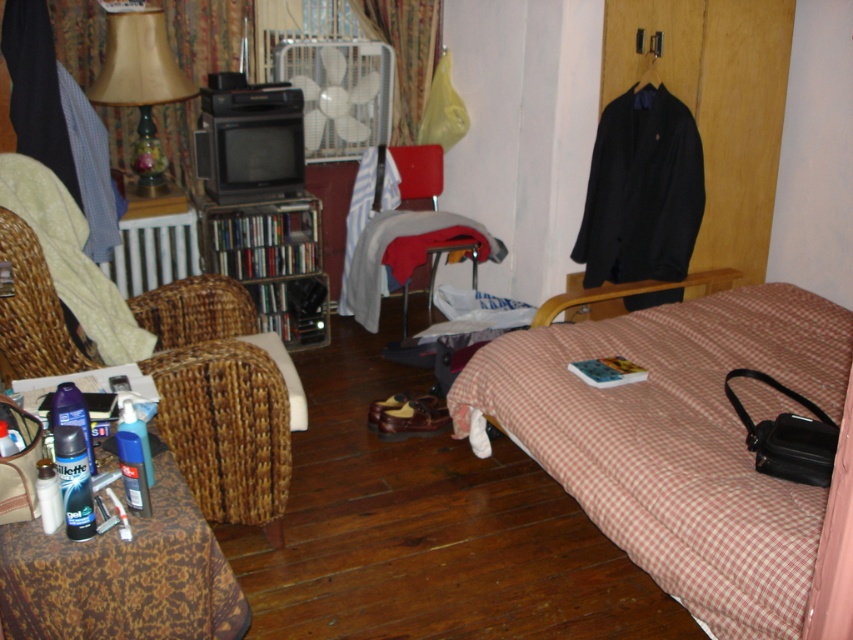
Question: Which is nearer to the white metal radiator at left?

Choices:
 (A) checkered fabric bed at lower right
 (B) woven wicker armchair at left

Answer: (B)

Question: Among these points, which one is nearest to the camera?

Choices:
 (A) (639, 541)
 (B) (16, 312)
 (C) (155, 260)
 (D) (403, 141)

Answer: (A)

Question: Does metallic silver bookshelf at center appear on the right side of matte fabric lamp at upper left?

Choices:
 (A) no
 (B) yes

Answer: (B)

Question: Can you confirm if matte fabric lamp at upper left is smaller than velvet-like curtain at upper center?

Choices:
 (A) yes
 (B) no

Answer: (B)

Question: Does checkered fabric bed at lower right lie in front of white metal radiator at left?

Choices:
 (A) no
 (B) yes

Answer: (B)

Question: Considering the real-world distances, which object is farthest from the gray fabric chair at center?

Choices:
 (A) velvet-like curtain at upper center
 (B) metallic silver bookshelf at center
 (C) checkered fabric bed at lower right
 (D) white metal radiator at left

Answer: (C)